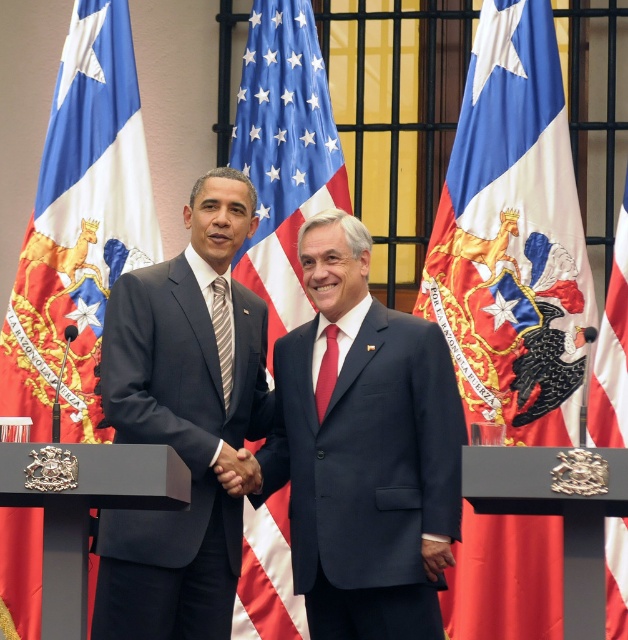
Does blue fabric flag at left appear on the left side of striped fabric tie at center?

Correct, you'll find blue fabric flag at left to the left of striped fabric tie at center.

In the scene shown: Who is lower down, blue fabric flag at left or striped fabric tie at center?

Positioned lower is striped fabric tie at center.

Is point (67, 412) behind point (224, 314)?

Yes, point (67, 412) is farther from viewer.

The image size is (628, 640). What are the coordinates of `blue fabric flag at left` in the screenshot? It's located at (78, 227).

Who is positioned more to the right, red fabric flag at center or striped fabric tie at center?

Positioned to the right is red fabric flag at center.

From the picture: Does red fabric flag at center appear under striped fabric tie at center?

No.

Image resolution: width=628 pixels, height=640 pixels. Describe the element at coordinates (612, 349) in the screenshot. I see `red fabric flag at center` at that location.

Where is `red fabric flag at center`? red fabric flag at center is located at coordinates (612, 349).

Who is positioned more to the right, matte black suit at left or black matte hand at center?

From the viewer's perspective, black matte hand at center appears more on the right side.

Can you confirm if matte black suit at left is bigger than black matte hand at center?

Indeed, matte black suit at left has a larger size compared to black matte hand at center.

Is point (257, 356) less distant than point (244, 474)?

No, (257, 356) is behind (244, 474).

The height and width of the screenshot is (640, 628). What are the coordinates of `matte black suit at left` in the screenshot? It's located at (181, 424).